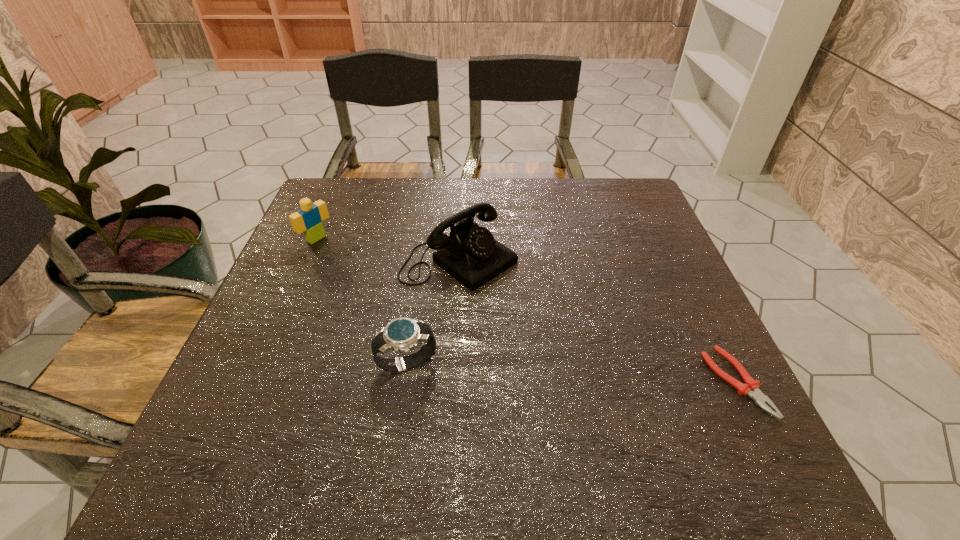
Identify the location of watch. (402, 334).

You are a GUI agent. You are given a task and a screenshot of the screen. Output one action in this format:
    pyautogui.click(x=<x>, y=<y>)
    Task: Click on the shortest object
    
    Given the screenshot: What is the action you would take?
    pyautogui.click(x=751, y=388)

Where is `pliers`? The width and height of the screenshot is (960, 540). pliers is located at coordinates (751, 388).

Locate an element on the screen. The width and height of the screenshot is (960, 540). the leftmost object is located at coordinates (309, 219).

What are the coordinates of `telephone` in the screenshot? It's located at (x=470, y=254).

Where is `free location located 0.250m on the right of the third tallest object`? Image resolution: width=960 pixels, height=540 pixels. free location located 0.250m on the right of the third tallest object is located at coordinates (564, 364).

Locate an element on the screen. free space located on the back of the pliers is located at coordinates (684, 278).

This screenshot has height=540, width=960. I want to click on vacant space located 0.190m on the face of the leftmost object, so click(x=375, y=276).

Where is `vacant region located on the face of the leftmost object`? The width and height of the screenshot is (960, 540). vacant region located on the face of the leftmost object is located at coordinates (441, 316).

Where is `free spot located on the face of the leftmost object`? This screenshot has width=960, height=540. free spot located on the face of the leftmost object is located at coordinates (358, 266).